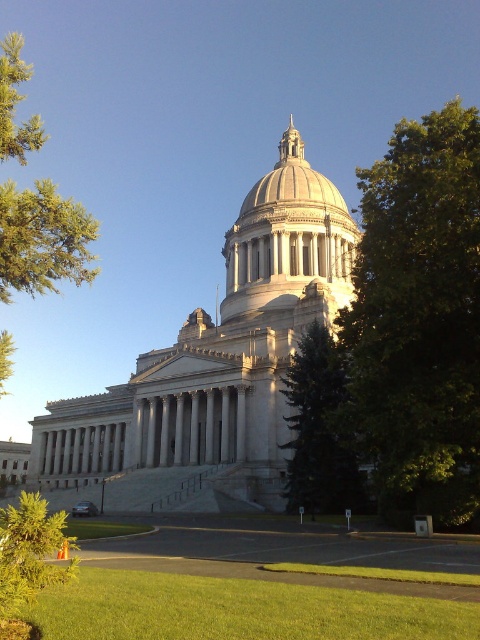
You are a landscape architect designing a garden around the grand neoclassical building. You need to place a new statue between the green textured tree at center and the green textured tree at lower left. Which tree should the statue be closer to if you want it to be near the larger tree?

The green textured tree at lower left is larger than the green textured tree at center, so the statue should be placed closer to the green textured tree at lower left.

You are a landscape architect designing a walking path between the green textured tree at center and the green textured tree at lower left. The path must be straight and 10 feet wide. Can you fit the path between them without bending it?

The distance between the green textured tree at center and the green textured tree at lower left is 82.99 feet. Since the path only needs to be 10 feet wide, there is more than enough space to fit a straight 10 feet wide path between them.